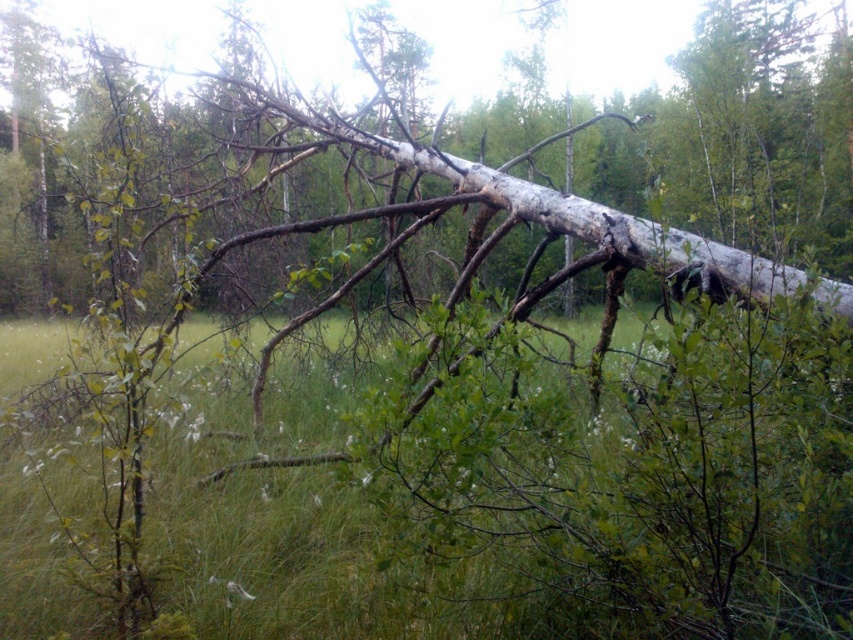
Question: Observing the image, what is the correct spatial positioning of green grass at center in reference to white bark tree at center?

Choices:
 (A) left
 (B) right

Answer: (A)

Question: Which of the following is the closest to the observer?

Choices:
 (A) (563, 596)
 (B) (428, 17)

Answer: (A)

Question: From the image, what is the correct spatial relationship of green grass at center in relation to white bark tree at center?

Choices:
 (A) above
 (B) below

Answer: (B)

Question: Does green grass at center have a smaller size compared to white bark tree at center?

Choices:
 (A) no
 (B) yes

Answer: (B)

Question: Which point is farther to the camera?

Choices:
 (A) (352, 416)
 (B) (131, 13)

Answer: (B)